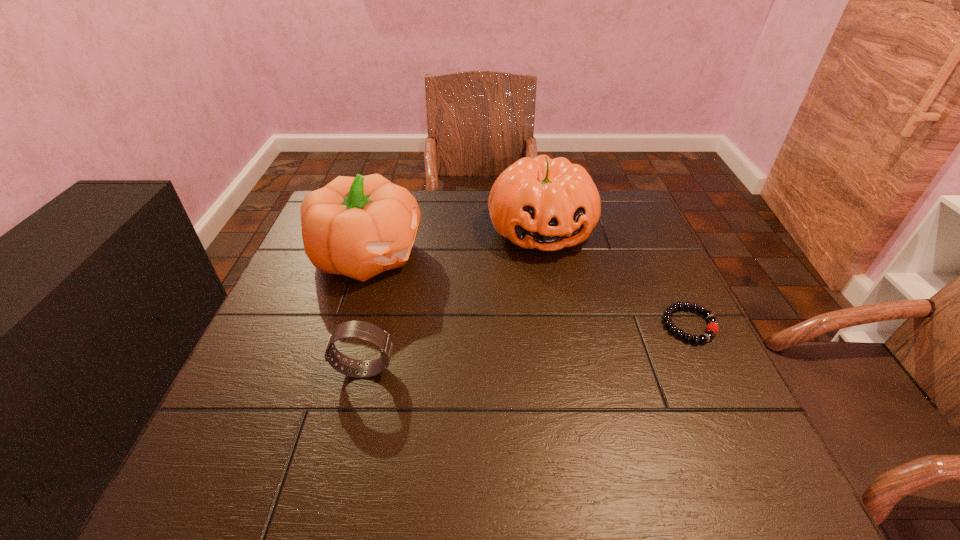
Locate an element on the screen. The image size is (960, 540). free space at the near edge is located at coordinates (477, 427).

In the image, there is a desktop. Where is `free space at the left edge`? free space at the left edge is located at coordinates (347, 295).

In the image, there is a desktop. Where is `vacant space at the right edge`? The image size is (960, 540). vacant space at the right edge is located at coordinates (636, 343).

Where is `free region at the far right corner of the desktop`? This screenshot has height=540, width=960. free region at the far right corner of the desktop is located at coordinates (636, 233).

You are a GUI agent. You are given a task and a screenshot of the screen. Output one action in this format:
    pyautogui.click(x=<x>, y=<y>)
    Task: Click on the free space between the nearest object and the left pumpkin
    
    Given the screenshot: What is the action you would take?
    pyautogui.click(x=365, y=312)

The image size is (960, 540). I want to click on blank region between the third object from left to right and the watch, so click(x=453, y=300).

Locate an element on the screen. Image resolution: width=960 pixels, height=540 pixels. empty location between the nearest object and the right pumpkin is located at coordinates (453, 300).

Find the location of a particular element. This screenshot has height=540, width=960. free space between the second object from right to left and the second shortest object is located at coordinates (453, 300).

I want to click on vacant area between the rightmost object and the left pumpkin, so click(527, 290).

Locate an element on the screen. vacant area that lies between the bracelet and the left pumpkin is located at coordinates (527, 290).